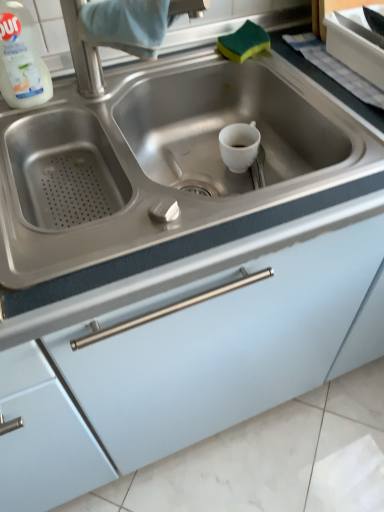
The image size is (384, 512). Find the location of `empty space that is to the right of white plastic bottle at upper left`. empty space that is to the right of white plastic bottle at upper left is located at coordinates (98, 92).